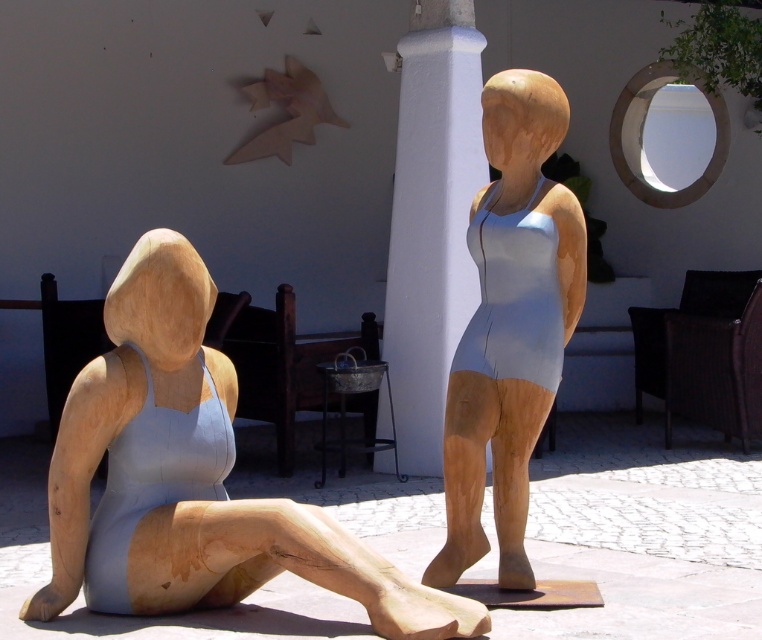
You are an art installer trying to move the matte wood figure at left and the white painted pillar at center through a narrow doorway. The doorway has a width of 1.2 meters. Can both objects pass through the doorway side by side?

The matte wood figure at left might be wider than white painted pillar at center, so there is uncertainty if both can pass through the doorway side by side. Measure their combined width to confirm.

You are a visitor at an art exhibit and notice the matte wood statue at center and the white painted pillar at center. Which object is closer to the ground?

The matte wood statue at center is below the white painted pillar at center, so it is closer to the ground.

You are standing in front of the two wooden sculptures and want to place a small flowerpot between them. The flowerpot must be placed exactly halfway between the point at coordinates point(168, 404) and point(530, 154). Will the flowerpot be closer to the seated sculpture or the standing sculpture?

The flowerpot placed exactly halfway between point(168, 404) and point(530, 154) will be closer to the seated sculpture because point(168, 404) is closer to the viewer than point(530, 154), meaning the midpoint is nearer to the seated sculpture.